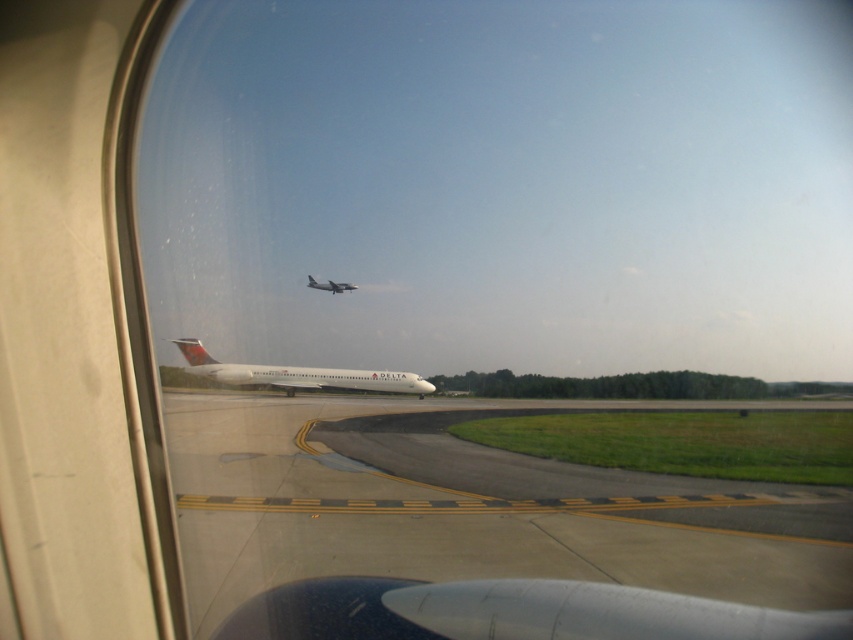
You are a passenger sitting near the window of an airplane. You notice two objects outside your window, the smooth asphalt tarmac at center and the white matte airplane at center. Which object is closer to you based on their positions?

The smooth asphalt tarmac at center is closer to you because it is positioned in front of the white matte airplane at center.

You are seated in an airplane and looking out the window. You notice a point at coordinates [299,374]. What object is located at that point?

The point at coordinates [299,374] corresponds to the white glossy airplane at center.